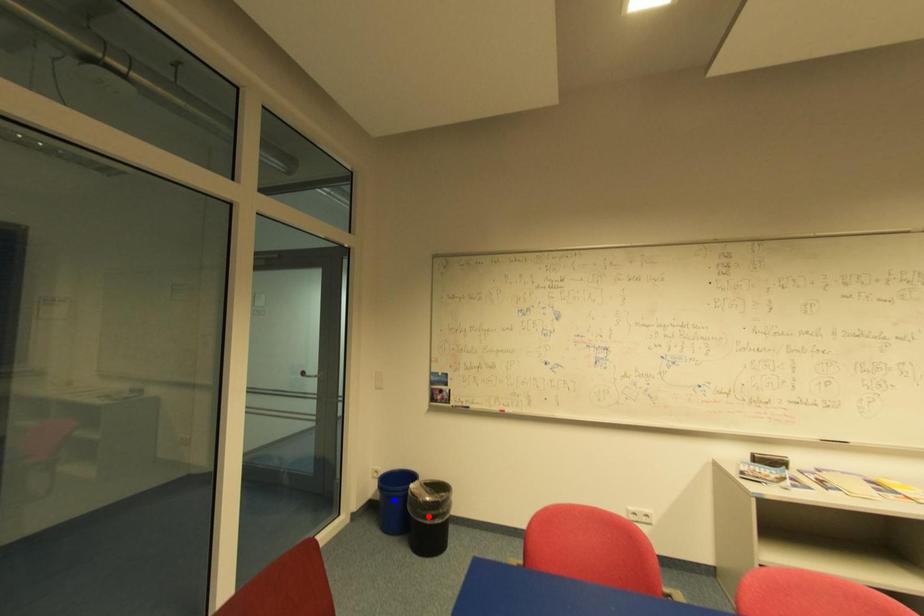
Question: Two points are marked on the image. Which point is closer to the camera?

Choices:
 (A) Blue point is closer.
 (B) Red point is closer.

Answer: (B)